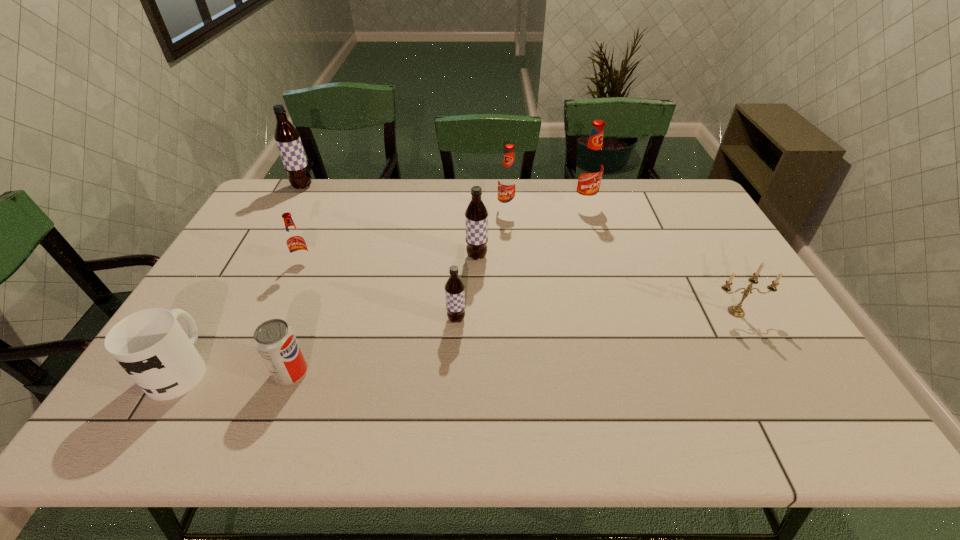
Locate an element on the screen. Image resolution: width=960 pixels, height=540 pixels. free spot between the soda and the mug is located at coordinates (236, 370).

This screenshot has height=540, width=960. Identify the location of free space between the third object from left to right and the nearest root beer. (380, 292).

The height and width of the screenshot is (540, 960). In order to click on vacant point located between the mug and the second red root beer from right to left in this screenshot , I will do `click(344, 289)`.

Locate an element on the screen. This screenshot has width=960, height=540. vacant space in between the rightmost root beer and the mug is located at coordinates (382, 286).

Identify the location of vacant point located between the nearest root beer and the mug. Image resolution: width=960 pixels, height=540 pixels. (319, 343).

This screenshot has width=960, height=540. In order to click on vacant space that's between the second nearest brown root beer and the fourth object from left to right in this screenshot , I will do `click(384, 314)`.

Choose which object is the seventh nearest neighbor to the fourth object from left to right. Please provide its 2D coordinates. Your answer should be formatted as a tuple, i.e. [(x, y)], where the tuple contains the x and y coordinates of a point satisfying the conditions above.

[(590, 169)]

Where is `object that stands as the fifth closest to the second nearest brown root beer`? The image size is (960, 540). object that stands as the fifth closest to the second nearest brown root beer is located at coordinates (274, 339).

Where is `the fifth closest root beer to the second root beer from right to left`? The height and width of the screenshot is (540, 960). the fifth closest root beer to the second root beer from right to left is located at coordinates (288, 141).

Locate an element on the screen. Image resolution: width=960 pixels, height=540 pixels. the closest root beer to the white mug is located at coordinates (295, 241).